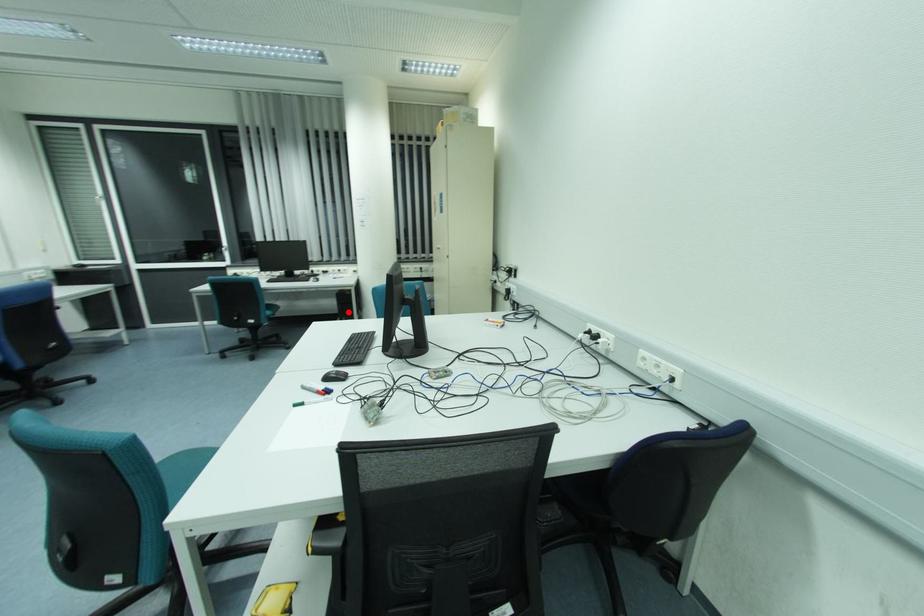
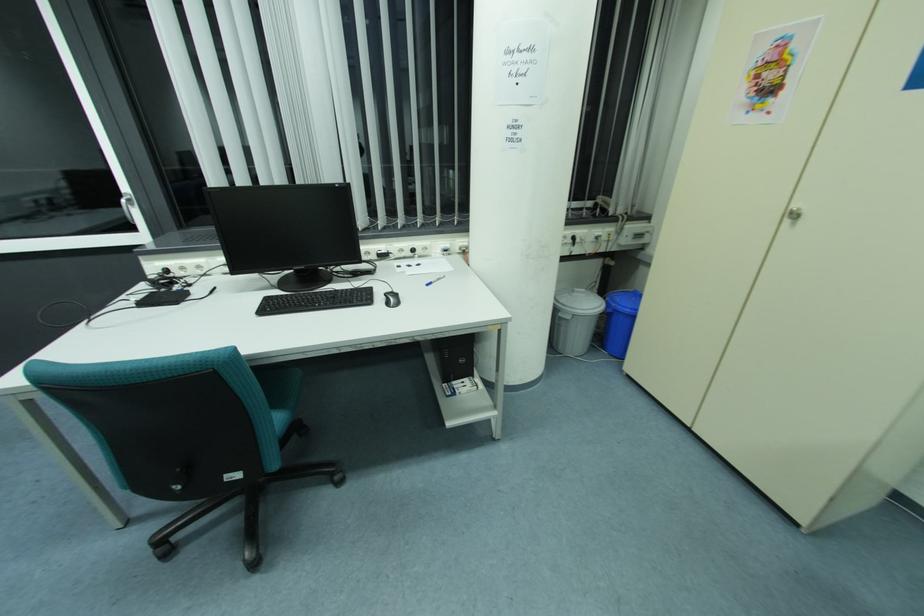
The point at the highlighted location is marked in the first image. Where is the corresponding point in the second image?

(462, 361)